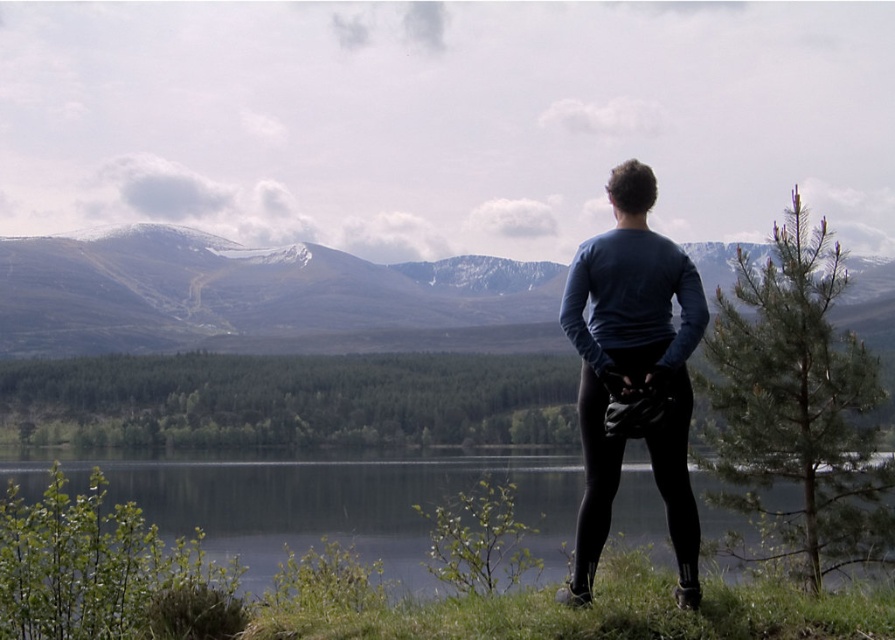
Question: Which object is closer to the camera taking this photo?

Choices:
 (A) dark blue long-sleeve shirt at center
 (B) sandy brown mountain at center
 (C) green grass at lower center
 (D) green needle-like pine at right

Answer: (A)

Question: Which object is closer to the camera taking this photo?

Choices:
 (A) sandy brown mountain at center
 (B) dark blue long-sleeve shirt at center
 (C) green grass at lower center
 (D) green needle-like pine at right

Answer: (B)

Question: Considering the real-world distances, which object is farthest from the sandy brown mountain at center?

Choices:
 (A) green needle-like pine at right
 (B) dark blue long-sleeve shirt at center

Answer: (B)

Question: In this image, where is green needle-like pine at right located relative to dark blue long-sleeve shirt at center?

Choices:
 (A) left
 (B) right

Answer: (B)

Question: Is green needle-like pine at right thinner than green grass at lower center?

Choices:
 (A) yes
 (B) no

Answer: (A)

Question: Does green needle-like pine at right have a larger size compared to dark blue long-sleeve shirt at center?

Choices:
 (A) yes
 (B) no

Answer: (B)